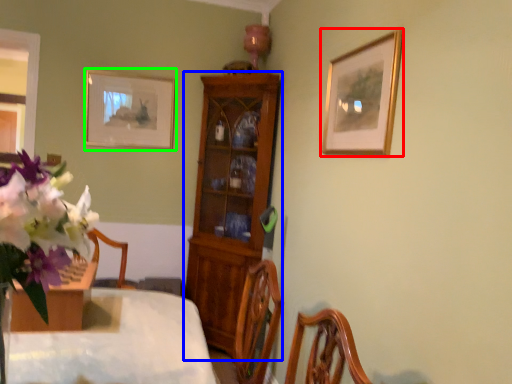
Question: Which object is positioned closest to picture frame (highlighted by a red box)? Select from cabinetry (highlighted by a blue box) and picture frame (highlighted by a green box).

Choices:
 (A) cabinetry
 (B) picture frame

Answer: (A)